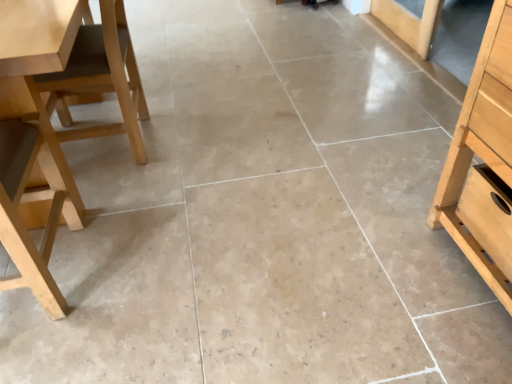
Question: Considering their positions, is light brown wood chair at left, the 2th chair in the front-to-back sequence, located in front of or behind light wood drawer at right?

Choices:
 (A) front
 (B) behind

Answer: (B)

Question: Do you think light brown wood chair at left, the 2th chair in the front-to-back sequence, is within light wood drawer at right, or outside of it?

Choices:
 (A) inside
 (B) outside

Answer: (B)

Question: Which is farther from the light wood drawer at right?

Choices:
 (A) light wood chair at left, the first chair when ordered from front to back
 (B) light brown wood chair at left, acting as the first chair starting from the back
 (C) light wood table at left

Answer: (B)

Question: Which object is the farthest from the light brown wood chair at left, the 2th chair in the front-to-back sequence?

Choices:
 (A) light wood chair at left, which is counted as the second chair, starting from the back
 (B) light wood drawer at right
 (C) light wood table at left

Answer: (B)